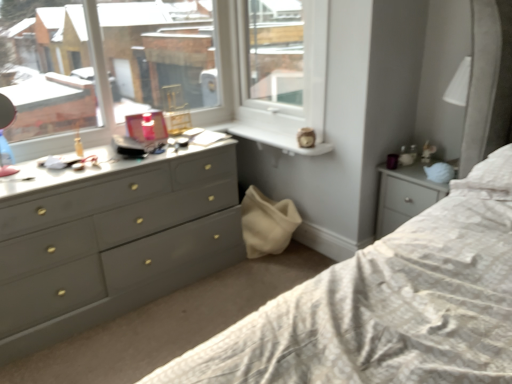
Describe the element at coordinates (118, 247) in the screenshot. I see `matte gray dresser at left` at that location.

The width and height of the screenshot is (512, 384). I want to click on matte gray dresser at left, so click(x=118, y=247).

The height and width of the screenshot is (384, 512). What do you see at coordinates (274, 56) in the screenshot? I see `white plastic window frame at upper center` at bounding box center [274, 56].

Locate an element on the screen. The image size is (512, 384). white plastic window frame at upper center is located at coordinates (274, 56).

This screenshot has height=384, width=512. What are the coordinates of `matte gray dresser at left` in the screenshot? It's located at (118, 247).

Can you confirm if matte gray dresser at left is positioned to the left of white plastic window frame at upper center?

Yes, matte gray dresser at left is to the left of white plastic window frame at upper center.

Is matte gray dresser at left closer to camera compared to white plastic window frame at upper center?

Yes, it is in front of white plastic window frame at upper center.

Considering the positions of point (125, 212) and point (261, 97), is point (125, 212) closer or farther from the camera than point (261, 97)?

Point (125, 212) is closer to the camera than point (261, 97).

From the image's perspective, does matte gray dresser at left appear lower than white plastic window frame at upper center?

Yes, from the image's perspective, matte gray dresser at left is beneath white plastic window frame at upper center.

From a real-world perspective, which object rests below the other?

matte gray dresser at left.

Is matte gray dresser at left wider or thinner than white plastic window frame at upper center?

Clearly, matte gray dresser at left has more width compared to white plastic window frame at upper center.

Is matte gray dresser at left taller than white plastic window frame at upper center?

No.

Considering the sizes of matte gray dresser at left and white plastic window frame at upper center in the image, is matte gray dresser at left bigger or smaller than white plastic window frame at upper center?

matte gray dresser at left is bigger than white plastic window frame at upper center.

Is matte gray dresser at left inside or outside of white plastic window frame at upper center?

The correct answer is: outside.

Is matte gray dresser at left positioned far away from white plastic window frame at upper center?

No, matte gray dresser at left is not far from white plastic window frame at upper center.

Is white plastic window frame at upper center at the back of matte gray dresser at left?

No.

Locate an element on the screen. This screenshot has height=384, width=512. chest of drawers in front of the white plastic window frame at upper center is located at coordinates (118, 247).

Is white plastic window frame at upper center at the left side of matte gray dresser at left?

In fact, white plastic window frame at upper center is to the right of matte gray dresser at left.

In the image, is white plastic window frame at upper center positioned in front of or behind matte gray dresser at left?

Visually, white plastic window frame at upper center is located behind matte gray dresser at left.

Considering the positions of points (289, 35) and (3, 312), is point (289, 35) closer to camera compared to point (3, 312)?

No, (289, 35) is behind (3, 312).

From the image's perspective, between white plastic window frame at upper center and matte gray dresser at left, which one is located above?

From the image's view, white plastic window frame at upper center is above.

From a real-world perspective, does white plastic window frame at upper center stand above matte gray dresser at left?

Yes.

Which object is thinner, white plastic window frame at upper center or matte gray dresser at left?

white plastic window frame at upper center.

Is white plastic window frame at upper center shorter than matte gray dresser at left?

In fact, white plastic window frame at upper center may be taller than matte gray dresser at left.

Which of these two, white plastic window frame at upper center or matte gray dresser at left, is bigger?

matte gray dresser at left is bigger.

Is white plastic window frame at upper center inside the boundaries of matte gray dresser at left, or outside?

white plastic window frame at upper center is located beyond the bounds of matte gray dresser at left.

Is white plastic window frame at upper center touching matte gray dresser at left?

No, white plastic window frame at upper center is not making contact with matte gray dresser at left.

Is white plastic window frame at upper center facing away from matte gray dresser at left?

No, white plastic window frame at upper center is not facing away from matte gray dresser at left.

How different are the orientations of white plastic window frame at upper center and matte gray dresser at left in degrees?

They differ by 89.6 degrees in their facing directions.

How far apart are white plastic window frame at upper center and matte gray dresser at left?

A distance of 38.77 inches exists between white plastic window frame at upper center and matte gray dresser at left.

You are a GUI agent. You are given a task and a screenshot of the screen. Output one action in this format:
    pyautogui.click(x=<x>, y=<y>)
    Task: Click on the window frame above the matte gray dresser at left (from the image's perspective)
    
    Given the screenshot: What is the action you would take?
    pyautogui.click(x=274, y=56)

The image size is (512, 384). I want to click on the chest of drawers below the white plastic window frame at upper center (from a real-world perspective), so click(x=118, y=247).

At what (x,y) coordinates should I click in order to perform the action: click on window frame located above the matte gray dresser at left (from a real-world perspective). Please return your answer as a coordinate pair (x, y). Image resolution: width=512 pixels, height=384 pixels. Looking at the image, I should click on (274, 56).